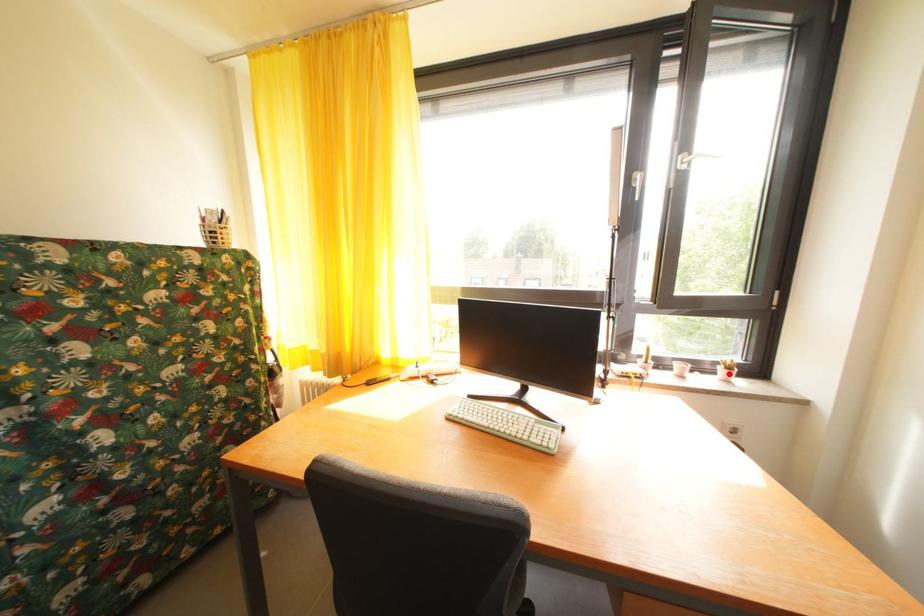
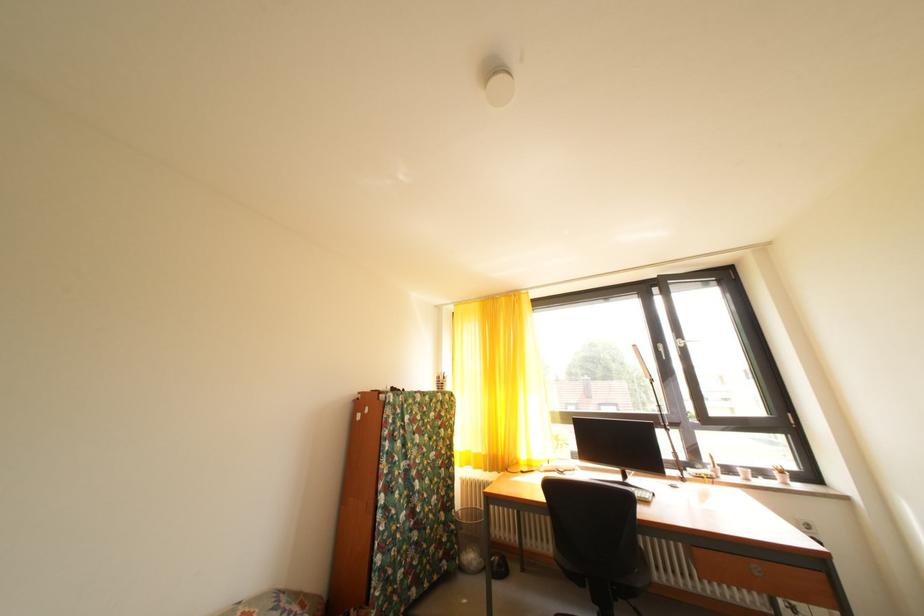
Find the pixel in the second image that matches the highlighted location in the first image.

(784, 479)